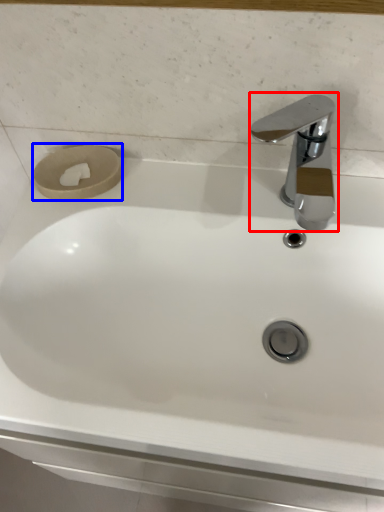
Question: Which object appears closest to the camera in this image, tap (highlighted by a red box) or toilet paper (highlighted by a blue box)?

Choices:
 (A) tap
 (B) toilet paper

Answer: (A)